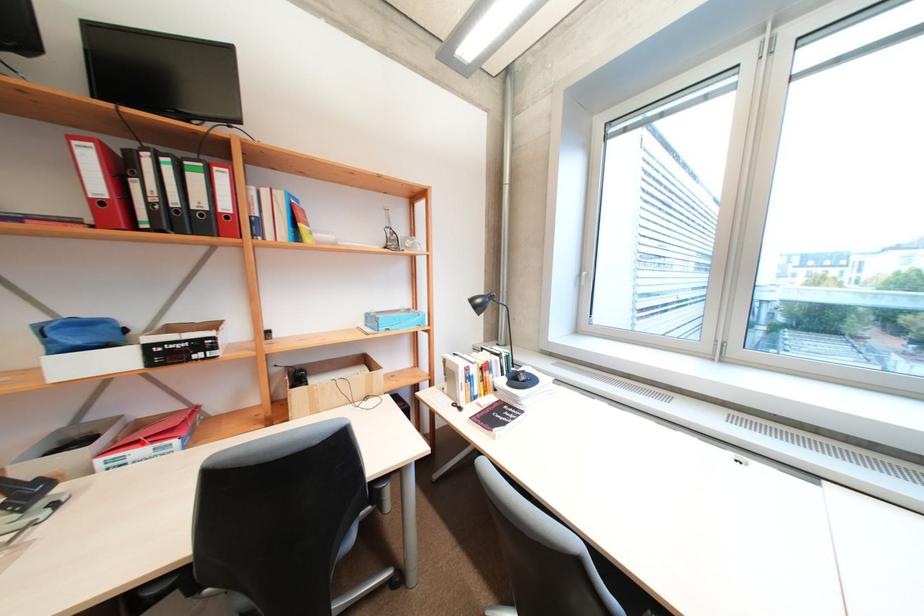
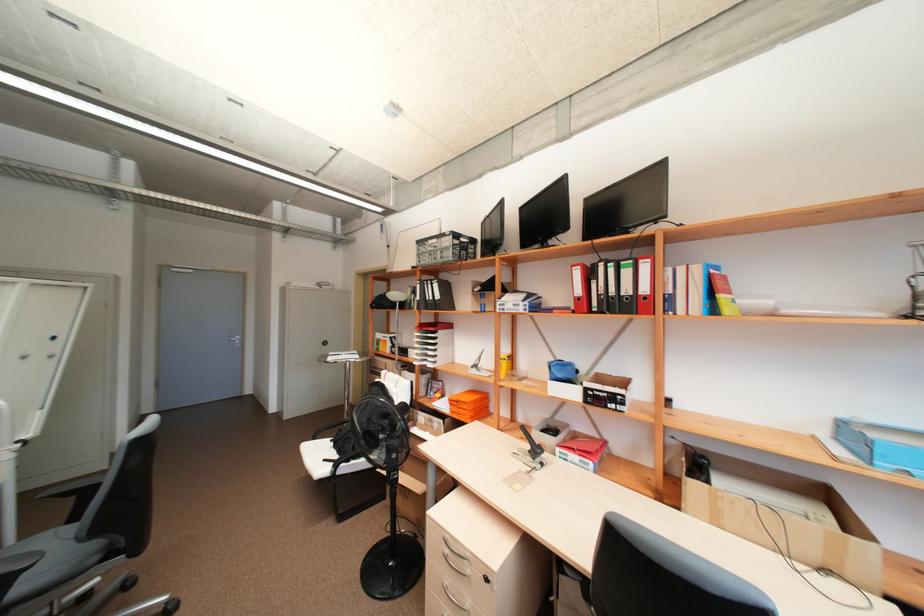
The point at the highlighted location is marked in the first image. Where is the corresponding point in the second image?

(578, 448)